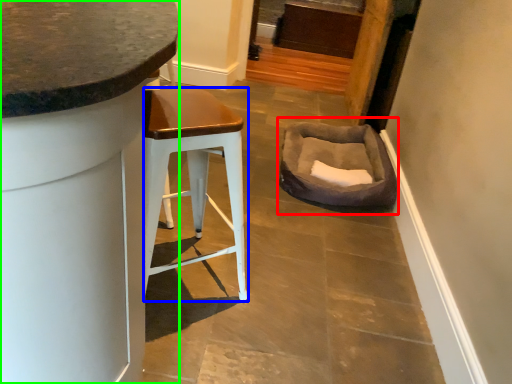
Question: Which object is the farthest from bean bag chair (highlighted by a red box)? Choose among these: stool (highlighted by a blue box) or cabinetry (highlighted by a green box).

Choices:
 (A) stool
 (B) cabinetry

Answer: (B)